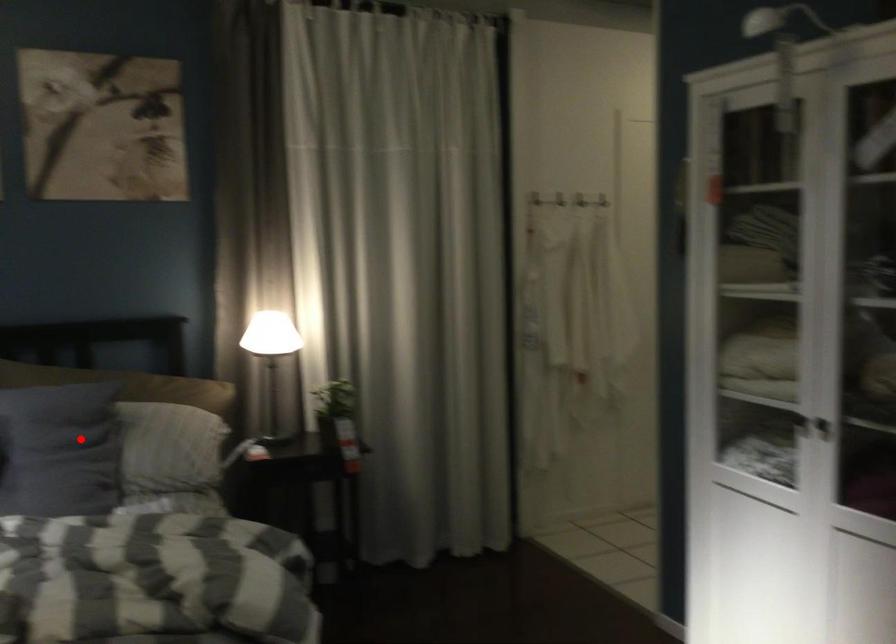
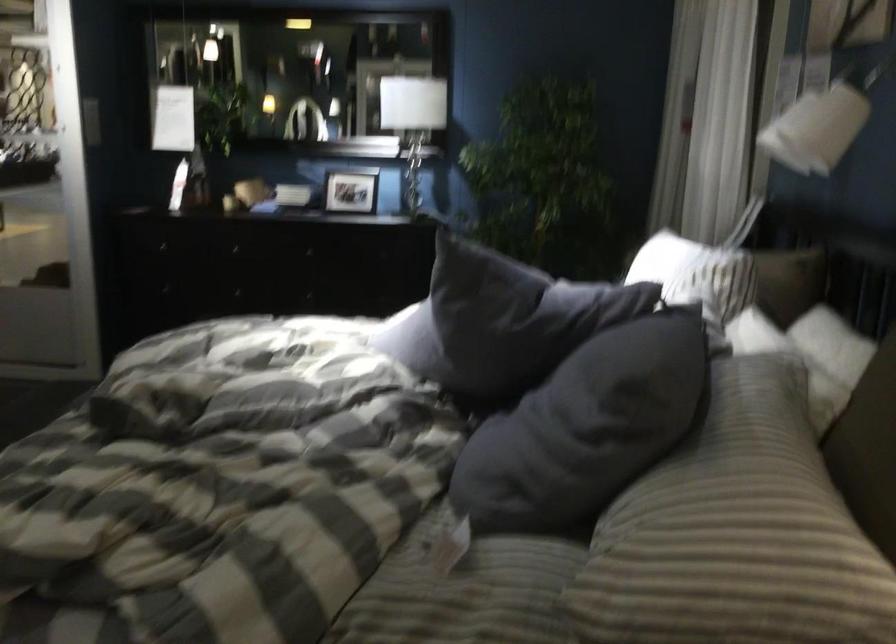
Question: I am providing you with two images of the same scene from different viewpoints. In image1, a red point is highlighted. Considering the same 3D point in image2, which of the following is correct?

Choices:
 (A) It is closer
 (B) It is farther

Answer: (A)